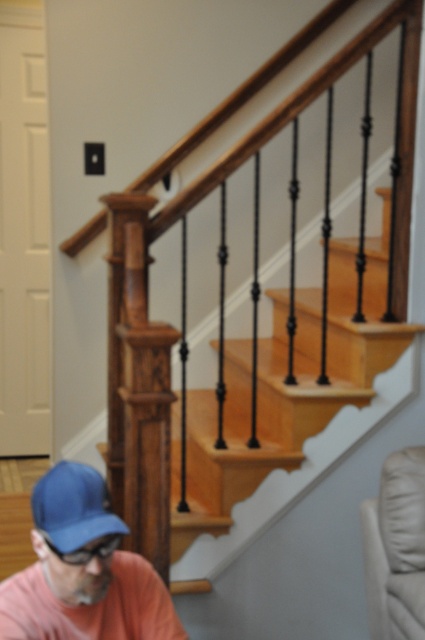
Question: Which point appears closest to the camera in this image?

Choices:
 (A) (130, 540)
 (B) (71, 536)
 (C) (118, 625)
 (D) (62, 560)

Answer: (B)

Question: Which object is farther from the camera taking this photo?

Choices:
 (A) matte black goggles at lower left
 (B) wooden stairs at upper center

Answer: (B)

Question: Which is farther from the blue fabric cap at lower left?

Choices:
 (A) wooden stairs at upper center
 (B) blue fabric baseball cap at lower left

Answer: (A)

Question: From the image, what is the correct spatial relationship of wooden stairs at upper center in relation to matte black goggles at lower left?

Choices:
 (A) below
 (B) above

Answer: (B)

Question: Can you confirm if wooden stairs at upper center is positioned to the right of blue fabric baseball cap at lower left?

Choices:
 (A) no
 (B) yes

Answer: (B)

Question: Can you confirm if wooden stairs at upper center is positioned to the left of matte black goggles at lower left?

Choices:
 (A) yes
 (B) no

Answer: (B)